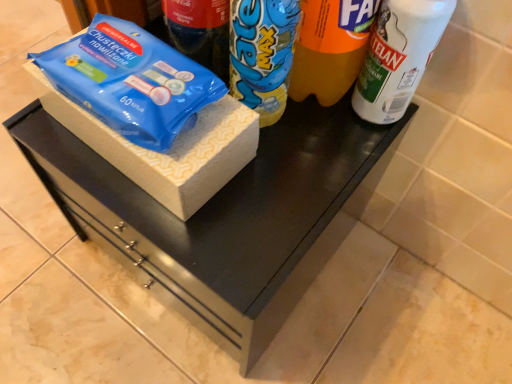
Question: In the image, is wooden box at center positioned in front of or behind white matte spray can at upper right?

Choices:
 (A) behind
 (B) front

Answer: (A)

Question: Choose the correct answer: Is wooden box at center inside white matte spray can at upper right or outside it?

Choices:
 (A) inside
 (B) outside

Answer: (B)

Question: Which object is the closest to the blue plastic bottle at center?

Choices:
 (A) blue plastic wipes at left
 (B) white matte spray can at upper right
 (C) wooden box at center
 (D) yellow matte drinking straw at center

Answer: (D)

Question: Estimate the real-world distances between objects in this image. Which object is closer to the blue plastic bottle at center?

Choices:
 (A) white matte spray can at upper right
 (B) wooden box at center
 (C) blue plastic wipes at left
 (D) yellow matte drinking straw at center

Answer: (D)